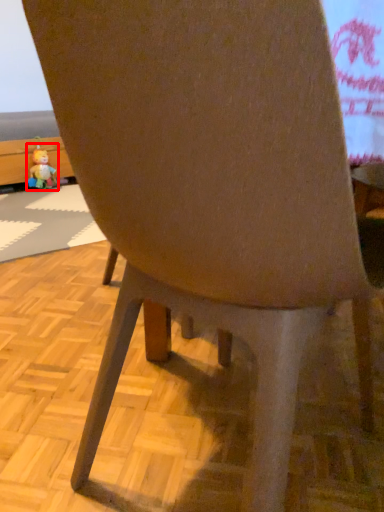
Question: Where is toy (annotated by the red box) located in relation to place mat in the image?

Choices:
 (A) left
 (B) right

Answer: (A)